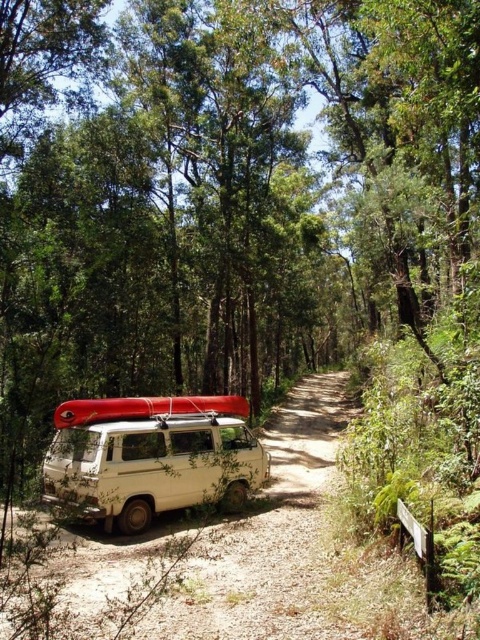
You are navigating a narrow forest path and see the white matte van at center. Based on its position, can you determine if it is parked closer to the left or right side of the path?

The white matte van at center is located at point coordinates that indicate it is positioned closer to the right side of the path.

You are a hiker standing at the point marked by the coordinates point (153, 465). What object are you standing on?

The point (153, 465) indicates the white matte van at center, so you are standing on the white matte van at center.